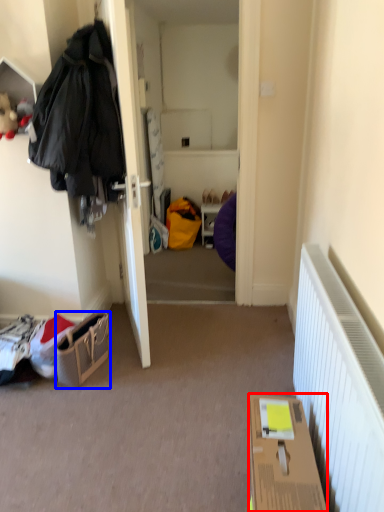
Question: Which of the following is the farthest to the observer, box (highlighted by a red box) or handbag (highlighted by a blue box)?

Choices:
 (A) box
 (B) handbag

Answer: (B)